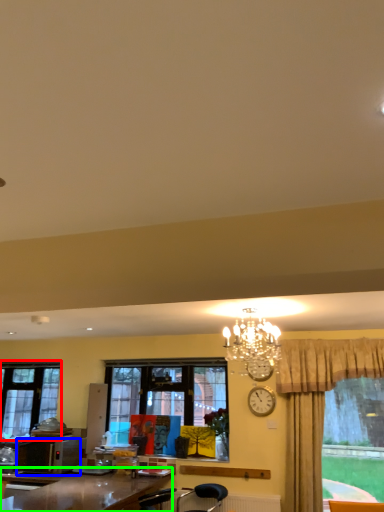
Question: Which object is positioned farthest from window (highlighted by a red box)? Select from microwave oven (highlighted by a blue box) and desk (highlighted by a green box).

Choices:
 (A) microwave oven
 (B) desk

Answer: (B)